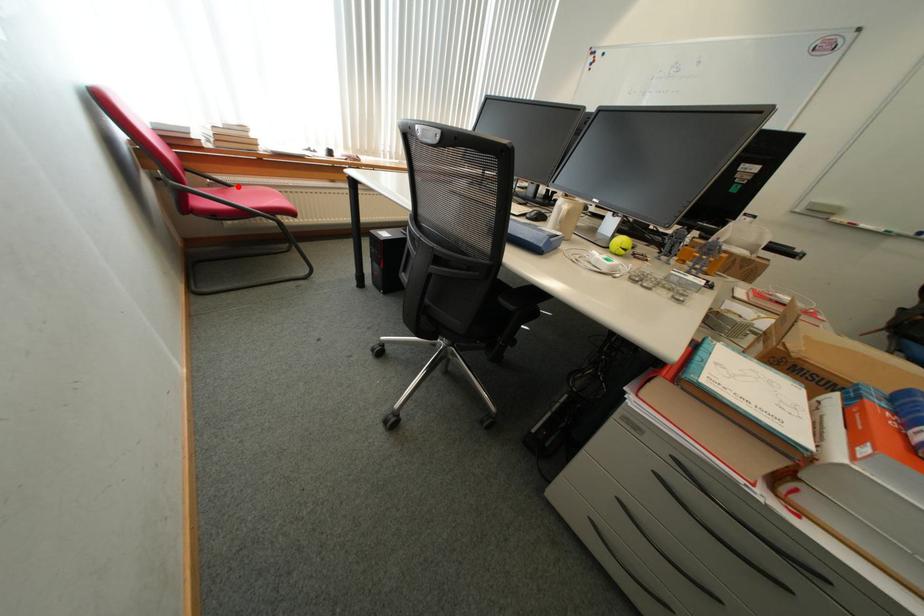
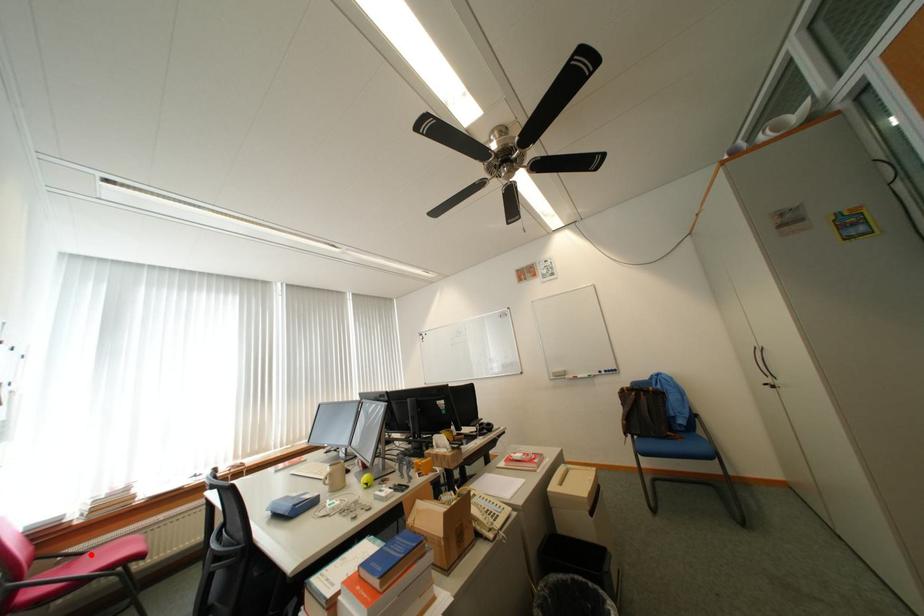
I am providing you with two images of the same scene from different viewpoints. A red point is marked on the first image and another point is marked on the second image. Is the red point in image1 aligned with the point shown in image2?

Yes